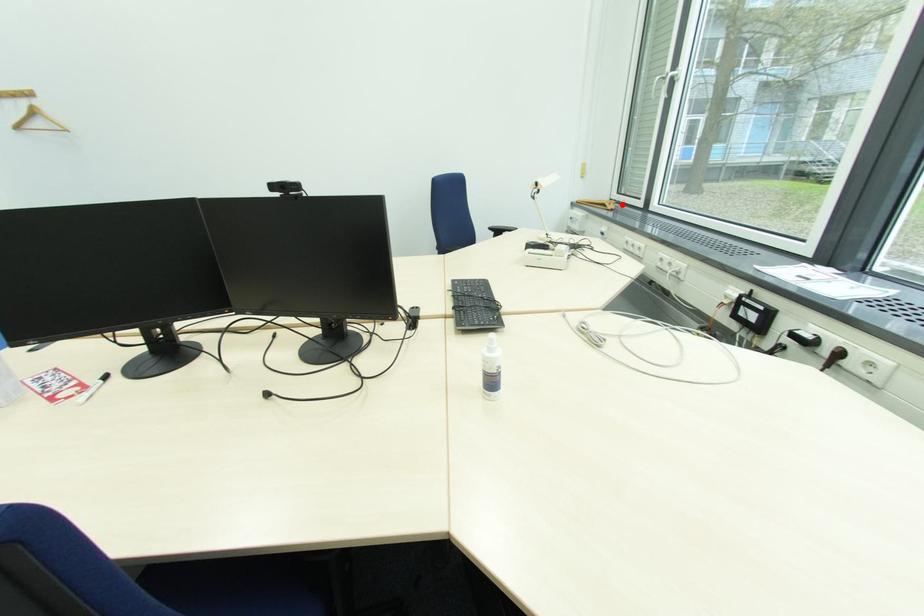
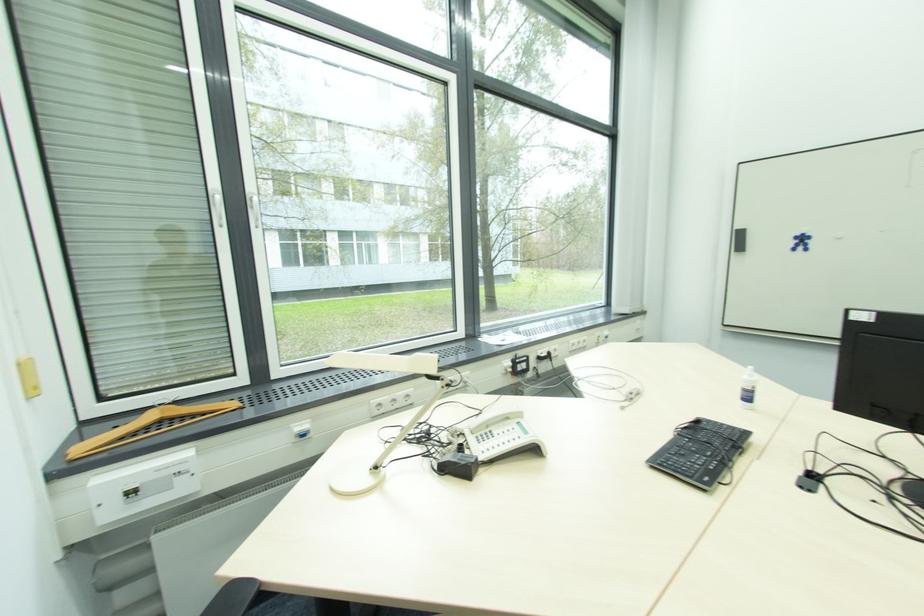
Where in the second image is the point corresponding to the highlighted location from the first image?

(179, 406)